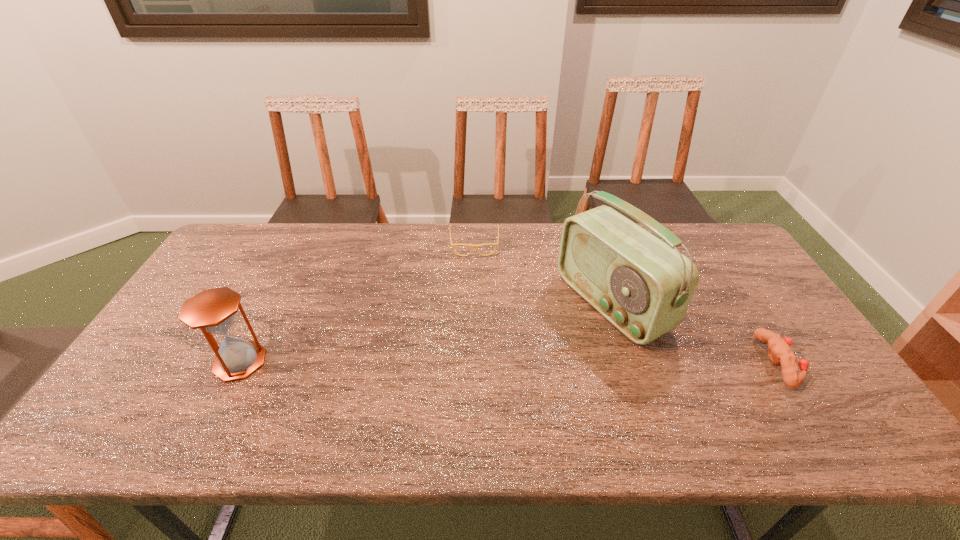
Identify the location of object that is positioned at the near right corner. Image resolution: width=960 pixels, height=540 pixels. pyautogui.click(x=779, y=351).

In the image, there is a desktop. Where is `free space at the far edge`? The image size is (960, 540). free space at the far edge is located at coordinates (362, 236).

You are a GUI agent. You are given a task and a screenshot of the screen. Output one action in this format:
    pyautogui.click(x=<x>, y=<y>)
    Task: Click on the vacant space at the left edge
    Image resolution: width=960 pixels, height=540 pixels.
    Given the screenshot: What is the action you would take?
    pyautogui.click(x=177, y=308)

Locate an element on the screen. The image size is (960, 540). vacant space at the right edge is located at coordinates (x=750, y=319).

Find the location of `free location at the far left corner`. free location at the far left corner is located at coordinates (245, 247).

Locate an element on the screen. The image size is (960, 540). vacant area at the far right corner of the desktop is located at coordinates (709, 232).

Locate an element on the screen. The width and height of the screenshot is (960, 540). empty space between the spectacles and the hourglass is located at coordinates click(x=357, y=303).

Identify the location of free spot between the third shortest object and the rightmost object. The height and width of the screenshot is (540, 960). (509, 362).

Identify the location of free spot between the second object from left to right and the tallest object. (543, 274).

Where is `vacant space that's between the puncher and the radio receiver`? This screenshot has height=540, width=960. vacant space that's between the puncher and the radio receiver is located at coordinates (695, 333).